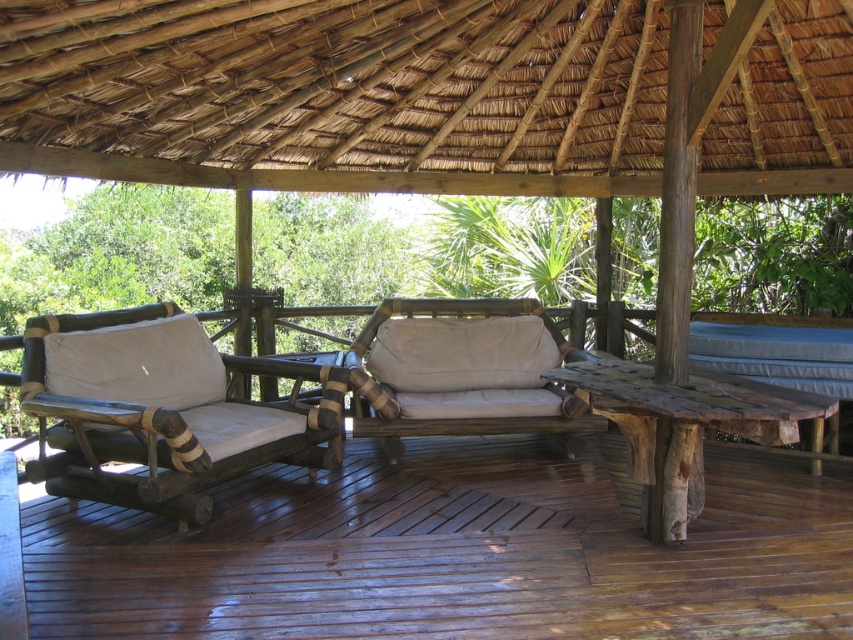
You are planning to place a small side table between the natural wood armchair at left and the beige fabric couch at center. Based on their positions, which object should the table be closer to?

The table should be placed closer to the beige fabric couch at center because the natural wood armchair at left is positioned to the left of the beige fabric couch at center, meaning the couch is to the right of the armchair. Therefore, placing the table closer to the couch would maintain symmetry or balance between the two seating areas.